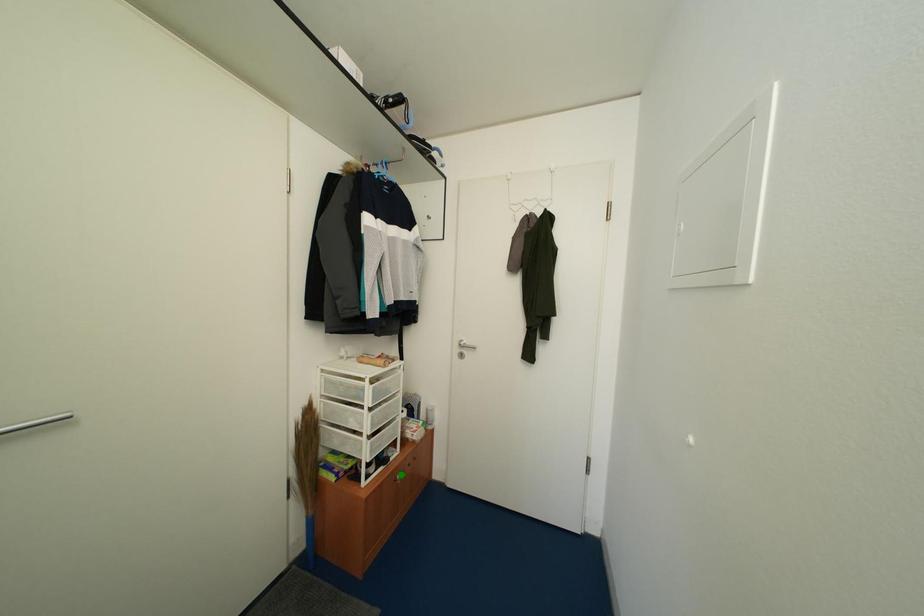
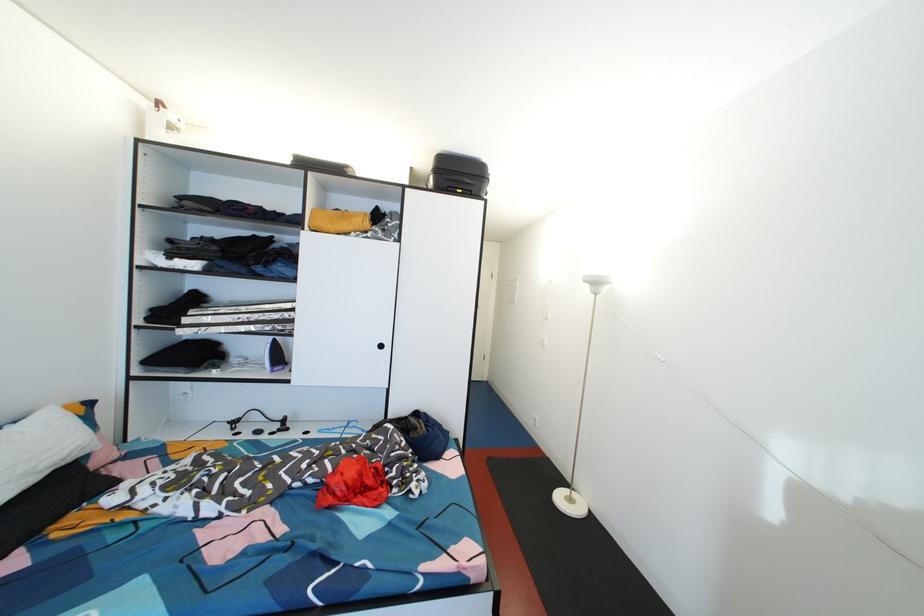
I am providing you with two images of the same scene from different viewpoints. Three points are marked in image1. Which point corresponds to a part or object that is occluded in image2?In image1, three points are marked. Which of them correspond to a part or object that is occluded in image2?Among the three points shown in image1, which one corresponds to a part or object that is no longer visible due to occlusion in image2?

yellow point, blue point, green point